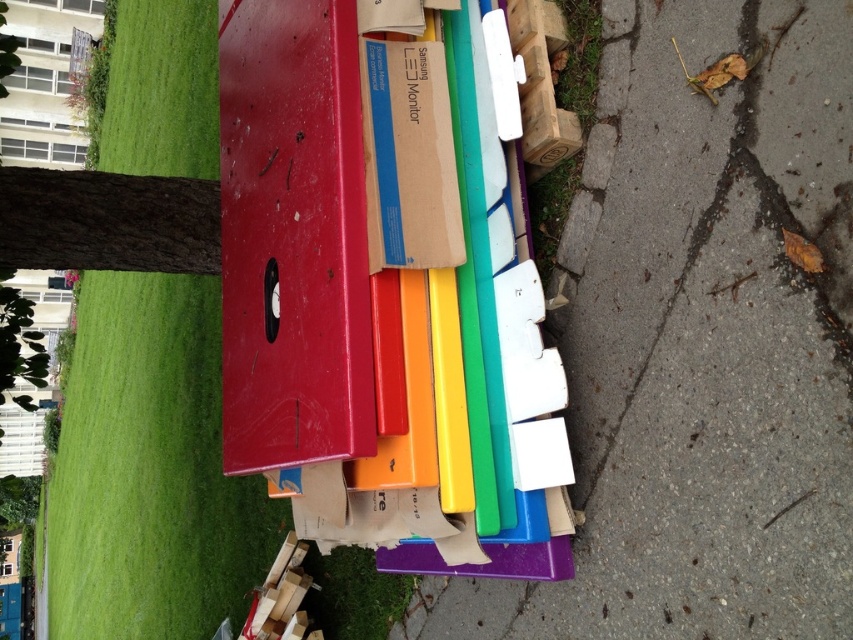
Question: Which object is farther from the camera taking this photo?

Choices:
 (A) green grass at left
 (B) smooth concrete pavement at right
 (C) cardboard samsung monitor at center

Answer: (A)

Question: Which object appears closest to the camera in this image?

Choices:
 (A) green grass at left
 (B) smooth concrete pavement at right
 (C) cardboard samsung monitor at center

Answer: (B)

Question: Does smooth concrete pavement at right come in front of cardboard samsung monitor at center?

Choices:
 (A) yes
 (B) no

Answer: (A)

Question: Is smooth concrete pavement at right further to the viewer compared to cardboard samsung monitor at center?

Choices:
 (A) yes
 (B) no

Answer: (B)

Question: Can you confirm if green grass at left is wider than cardboard samsung monitor at center?

Choices:
 (A) yes
 (B) no

Answer: (A)

Question: Which object is farther from the camera taking this photo?

Choices:
 (A) green grass at left
 (B) cardboard samsung monitor at center
 (C) smooth concrete pavement at right

Answer: (A)